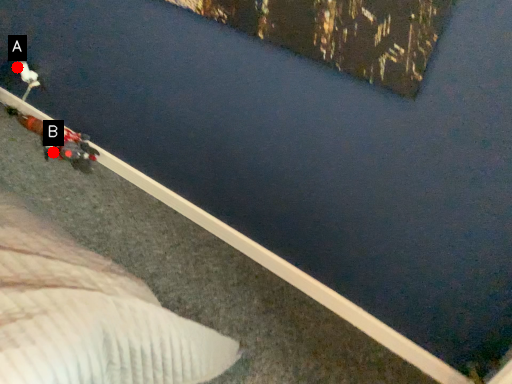
Question: Two points are circled on the image, labeled by A and B beside each circle. Among these points, which one is farthest from the camera?

Choices:
 (A) A is further
 (B) B is further

Answer: (A)